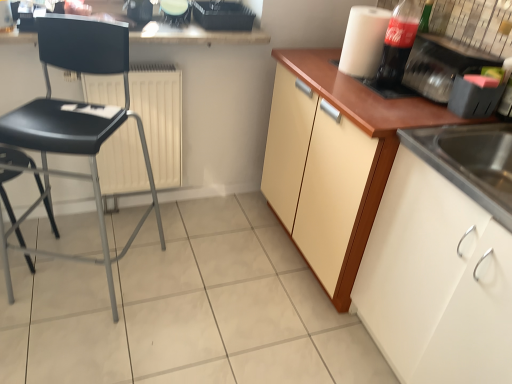
Locate an element on the screen. This screenshot has width=512, height=384. free space in front of white glossy blender at upper center, which appears as the 3th appliance when viewed from the right is located at coordinates (164, 30).